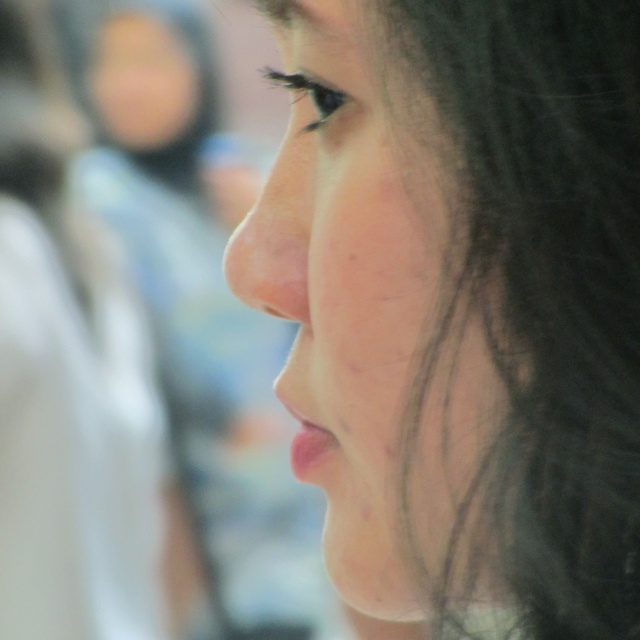
Question: Can you confirm if smooth skin nose at center is positioned to the right of shiny black eye at upper center?

Choices:
 (A) yes
 (B) no

Answer: (B)

Question: Which is farther from the smooth skin face at center?

Choices:
 (A) shiny black eye at upper center
 (B) smooth skin nose at center

Answer: (B)

Question: Considering the real-world distances, which object is closest to the smooth skin face at center?

Choices:
 (A) smooth skin nose at center
 (B) shiny black eye at upper center

Answer: (B)

Question: Observing the image, what is the correct spatial positioning of smooth skin face at center in reference to shiny black eye at upper center?

Choices:
 (A) above
 (B) below

Answer: (B)

Question: Is smooth skin nose at center thinner than shiny black eye at upper center?

Choices:
 (A) yes
 (B) no

Answer: (B)

Question: Which of the following is the farthest from the observer?

Choices:
 (A) (474, 392)
 (B) (340, 93)
 (C) (298, 195)

Answer: (C)